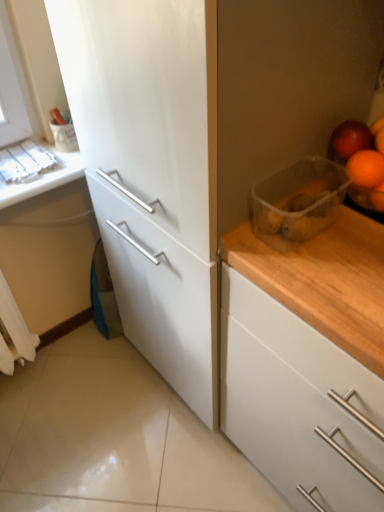
In order to click on blank area beneath white matte counter top at upper left (from a real-world perspective) in this screenshot , I will do `click(82, 334)`.